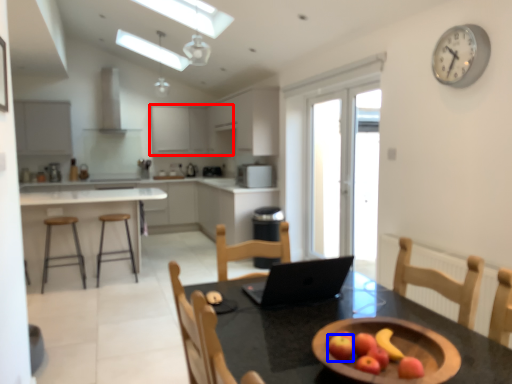
Question: Which object is closer to the camera taking this photo, cabinetry (highlighted by a red box) or apple (highlighted by a blue box)?

Choices:
 (A) cabinetry
 (B) apple

Answer: (B)